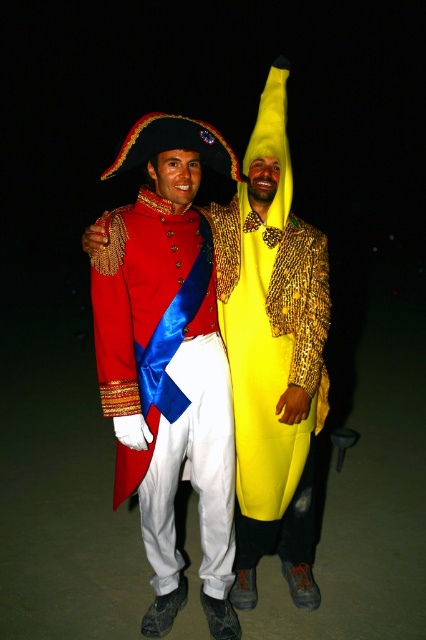
You are a photographer setting up a camera 1 meter away from the shiny red coat at center and the yellow matte banana at center. Can you fit both subjects into a single frame that is 1 meter wide without moving the camera?

The distance between the shiny red coat at center and yellow matte banana at center is 22.30 centimeters. Since the camera frame is 1 meter wide and the subjects are only 22.30 cm apart, both can easily fit within the frame without moving the camera.

You are a photographer trying to capture a clear photo of the shiny red coat at center and the yellow matte banana at center. Since the camera can only focus on objects at the same distance, which object should you move closer to the camera to align their distances?

To align their distances, you should move the yellow matte banana at center closer to the camera because the shiny red coat at center is currently closer to the viewer. Moving the banana forward will bring it to the same distance as the coat, allowing both to be in focus.